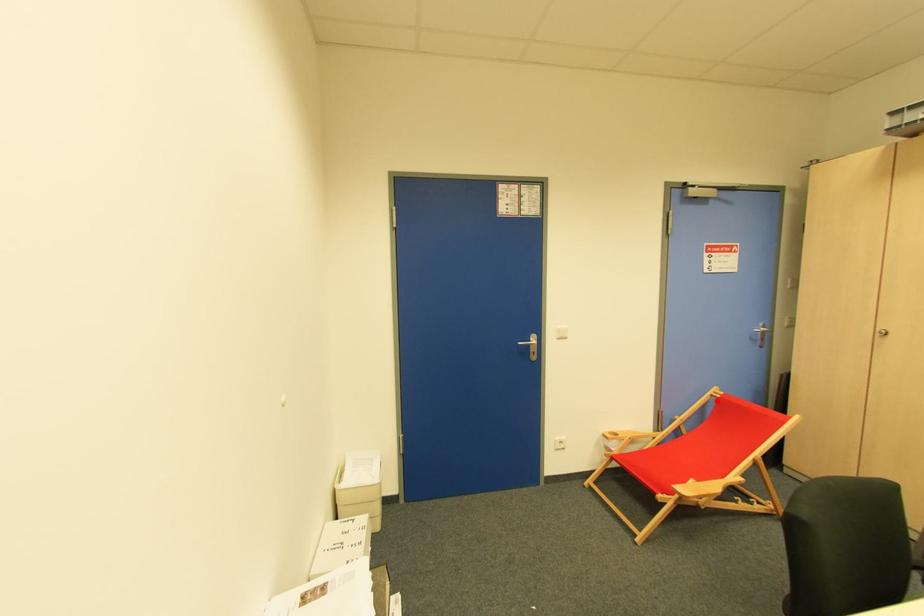
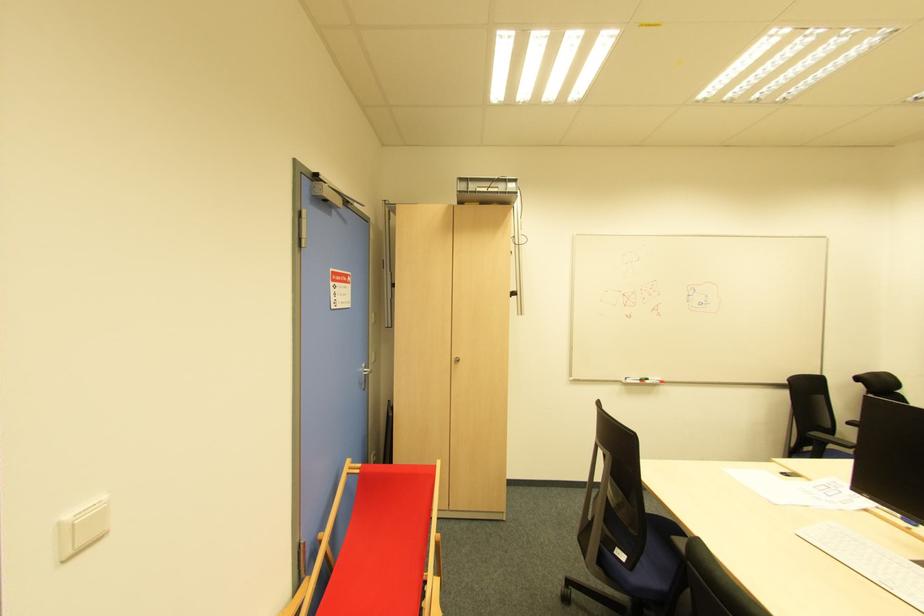
Question: I am providing you with two images of the same scene from different viewpoints. In image1, a red point is highlighted. Considering the same 3D point in image2, which of the following is correct?

Choices:
 (A) It is closer
 (B) It is farther

Answer: (A)